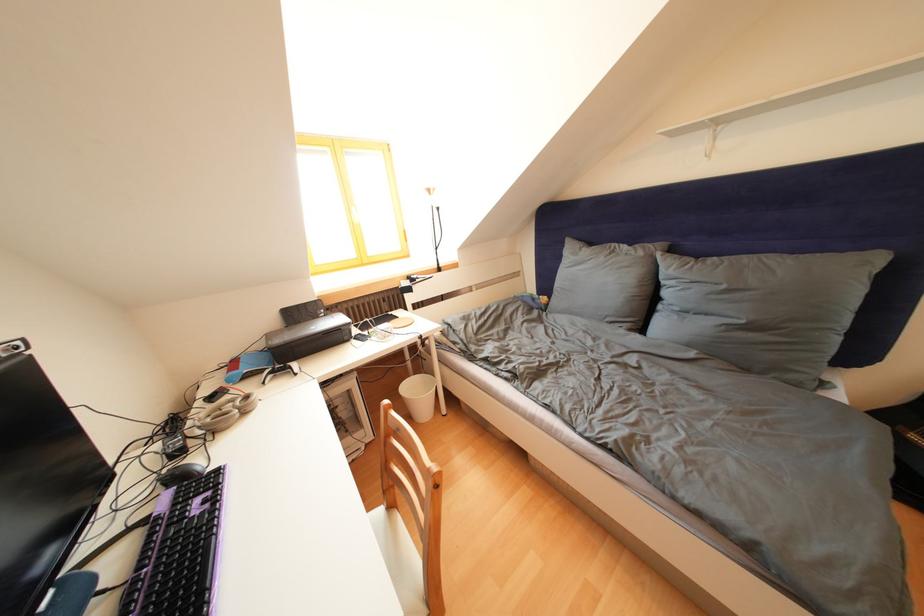
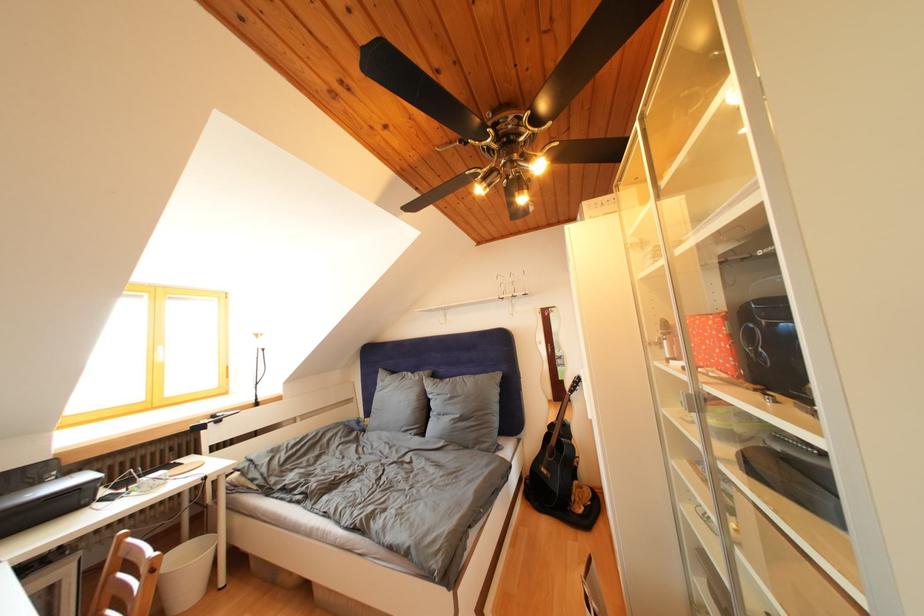
In the second image, find the point that corresponds to (x=599, y=248) in the first image.

(400, 378)